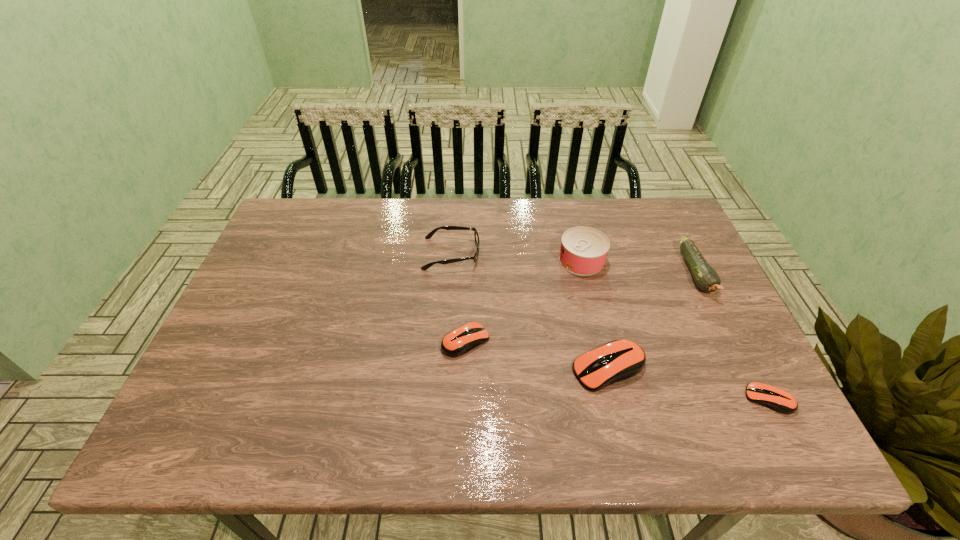
This screenshot has height=540, width=960. Find the location of `free space at the left edge`. free space at the left edge is located at coordinates (298, 283).

Find the location of a particular element. The height and width of the screenshot is (540, 960). free spot at the right edge of the desktop is located at coordinates (674, 319).

Identify the location of vacant area at the far left corner. The height and width of the screenshot is (540, 960). (288, 222).

The image size is (960, 540). Find the location of `free space at the near left corner of the desktop`. free space at the near left corner of the desktop is located at coordinates (231, 391).

In the image, there is a desktop. Where is `vacant space at the far right corner`? Image resolution: width=960 pixels, height=540 pixels. vacant space at the far right corner is located at coordinates (635, 206).

At what (x,y) coordinates should I click in order to perform the action: click on free space between the shortest object and the second computer mouse from right to left. Please return your answer as a coordinate pair (x, y). Looking at the image, I should click on (689, 384).

Locate an element on the screen. vacant space in between the tallest computer mouse and the can is located at coordinates (595, 314).

At what (x,y) coordinates should I click in order to perform the action: click on free space between the tallest object and the shortest object. Please return your answer as a coordinate pair (x, y). Image resolution: width=960 pixels, height=540 pixels. Looking at the image, I should click on (675, 330).

You are a GUI agent. You are given a task and a screenshot of the screen. Output one action in this format:
    pyautogui.click(x=<x>, y=<y>)
    Task: Click on the vacant area between the zucchini and the can
    The height and width of the screenshot is (540, 960).
    Given the screenshot: What is the action you would take?
    pyautogui.click(x=639, y=266)

This screenshot has width=960, height=540. Identify the location of free space that is in between the tallest object and the shortest object. (675, 330).